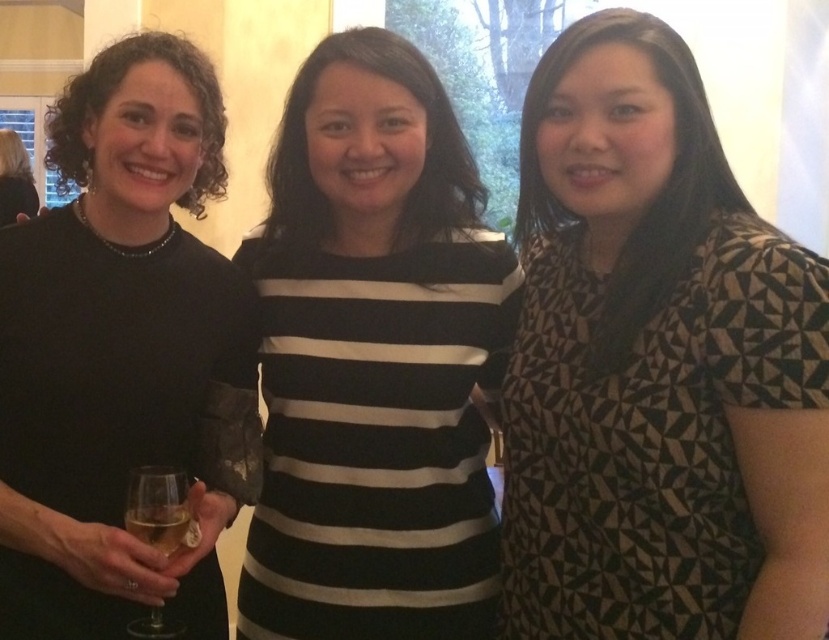
In the scene shown: You are a photographer trying to capture the black geometric patterned dress at center in the image. The camera is set to focus on the point at coordinate point (657, 365). Will this point be on the black geometric patterned dress at center?

Yes, the point (657, 365) corresponds to the black geometric patterned dress at center, so the camera will focus on the dress.